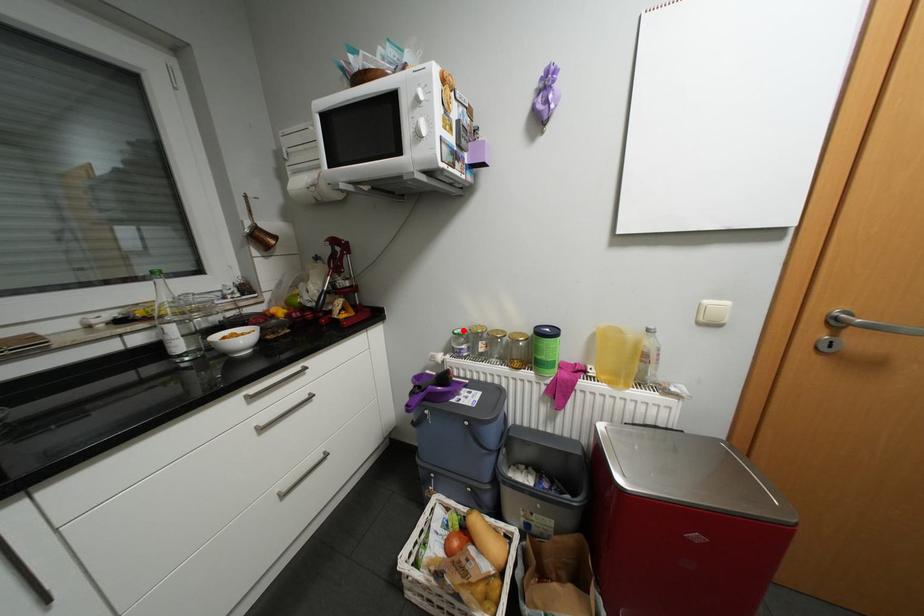
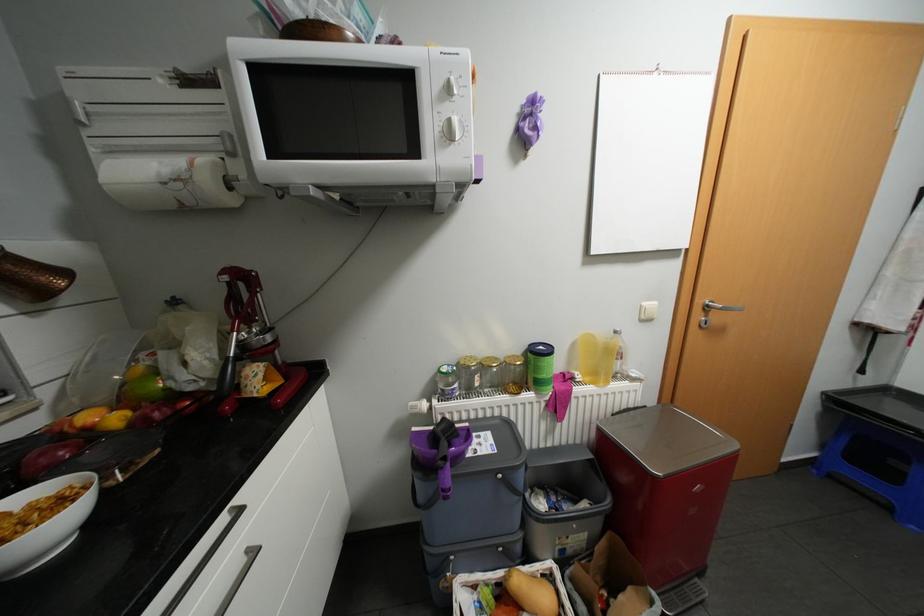
In the second image, find the point that corresponds to the highlighted location in the first image.

(452, 369)